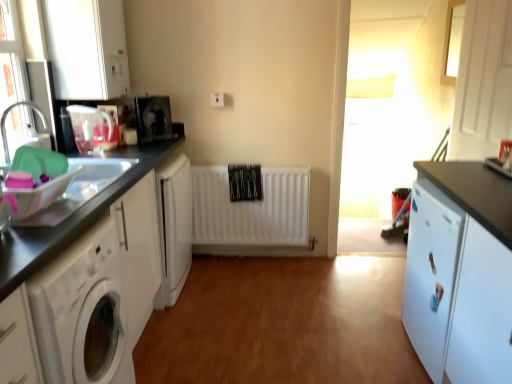
Question: Is translucent plastic sink at left far from brushed metal faucet at left?

Choices:
 (A) yes
 (B) no

Answer: (B)

Question: Is translucent plastic sink at left in contact with brushed metal faucet at left?

Choices:
 (A) no
 (B) yes

Answer: (A)

Question: Can you confirm if translucent plastic sink at left is thinner than brushed metal faucet at left?

Choices:
 (A) yes
 (B) no

Answer: (B)

Question: From the image's perspective, is translucent plastic sink at left over brushed metal faucet at left?

Choices:
 (A) no
 (B) yes

Answer: (A)

Question: Is translucent plastic sink at left to the left of brushed metal faucet at left from the viewer's perspective?

Choices:
 (A) yes
 (B) no

Answer: (B)

Question: Could you tell me if translucent plastic sink at left is facing brushed metal faucet at left?

Choices:
 (A) yes
 (B) no

Answer: (B)

Question: Considering the relative sizes of white glossy washing machine at lower left and white matte washing machine at left in the image provided, is white glossy washing machine at lower left shorter than white matte washing machine at left?

Choices:
 (A) no
 (B) yes

Answer: (B)

Question: Is white glossy washing machine at lower left thinner than white matte washing machine at left?

Choices:
 (A) yes
 (B) no

Answer: (B)

Question: Is white glossy washing machine at lower left aimed at white matte washing machine at left?

Choices:
 (A) no
 (B) yes

Answer: (A)

Question: Is the depth of white glossy washing machine at lower left greater than that of white matte washing machine at left?

Choices:
 (A) no
 (B) yes

Answer: (B)

Question: Is white glossy washing machine at lower left next to white matte washing machine at left?

Choices:
 (A) no
 (B) yes

Answer: (A)

Question: Considering the relative sizes of white glossy washing machine at lower left and white matte washing machine at left in the image provided, is white glossy washing machine at lower left bigger than white matte washing machine at left?

Choices:
 (A) no
 (B) yes

Answer: (A)

Question: Is white matte cabinet at upper left, the 3th cabinetry when ordered from right to left, next to white matte cabinet at left, the 2th cabinetry from the right?

Choices:
 (A) yes
 (B) no

Answer: (B)